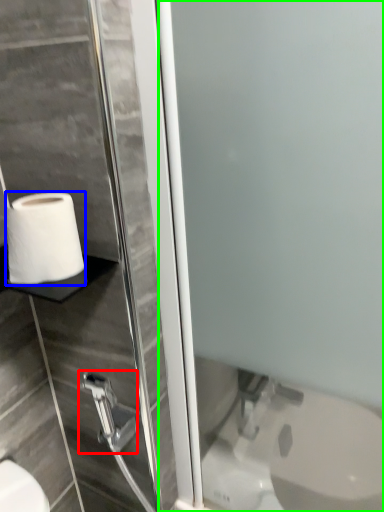
Question: Which object is the closest to the shower (highlighted by a red box)? Choose among these: toilet paper (highlighted by a blue box) or screen door (highlighted by a green box).

Choices:
 (A) toilet paper
 (B) screen door

Answer: (A)